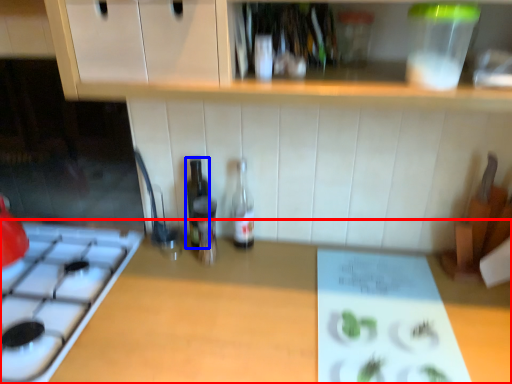
Question: Which of the following is the farthest to the observer, countertop (highlighted by a red box) or bottle (highlighted by a blue box)?

Choices:
 (A) countertop
 (B) bottle

Answer: (B)